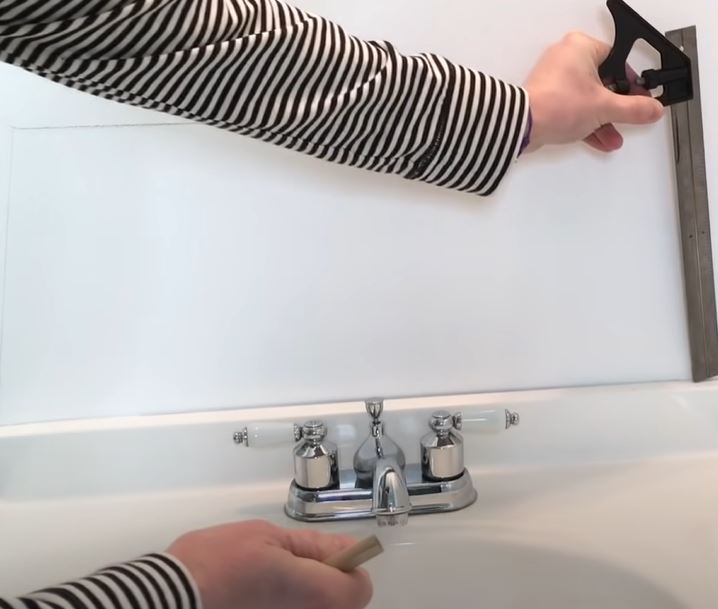
Where is `wall`? wall is located at coordinates (470, 257).